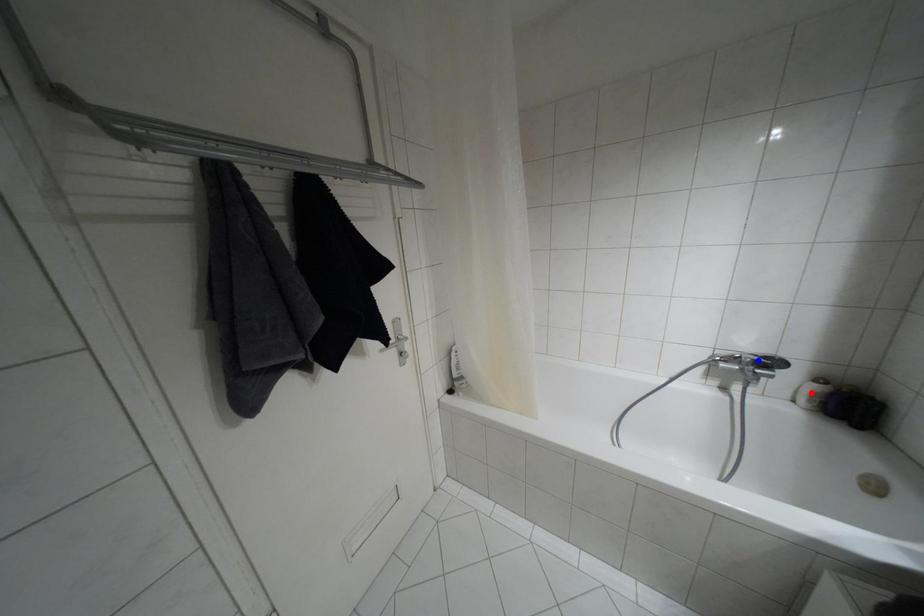
Question: In the image, two points are highlighted. Which point is nearer to the camera? Reply with the corresponding letter.

Choices:
 (A) blue point
 (B) red point

Answer: (B)